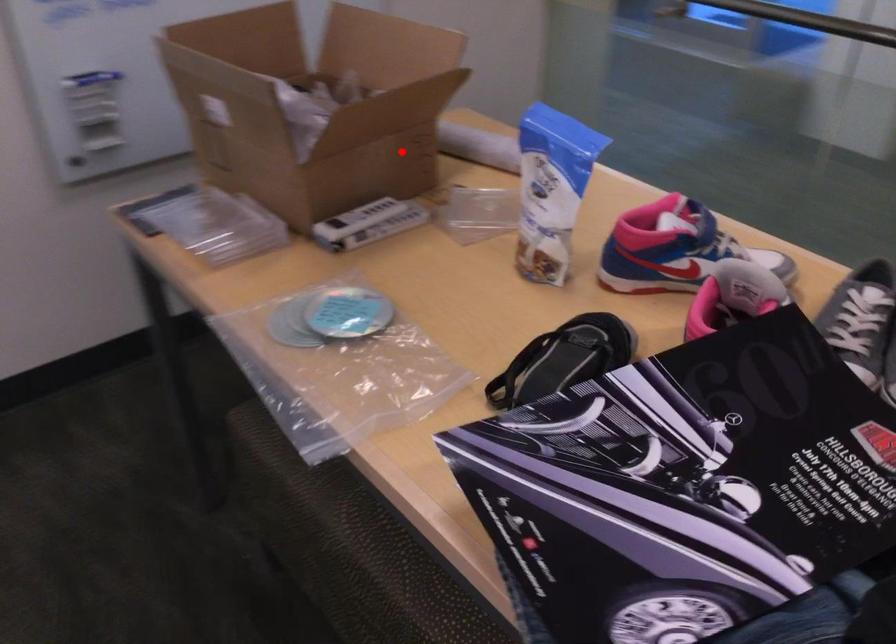
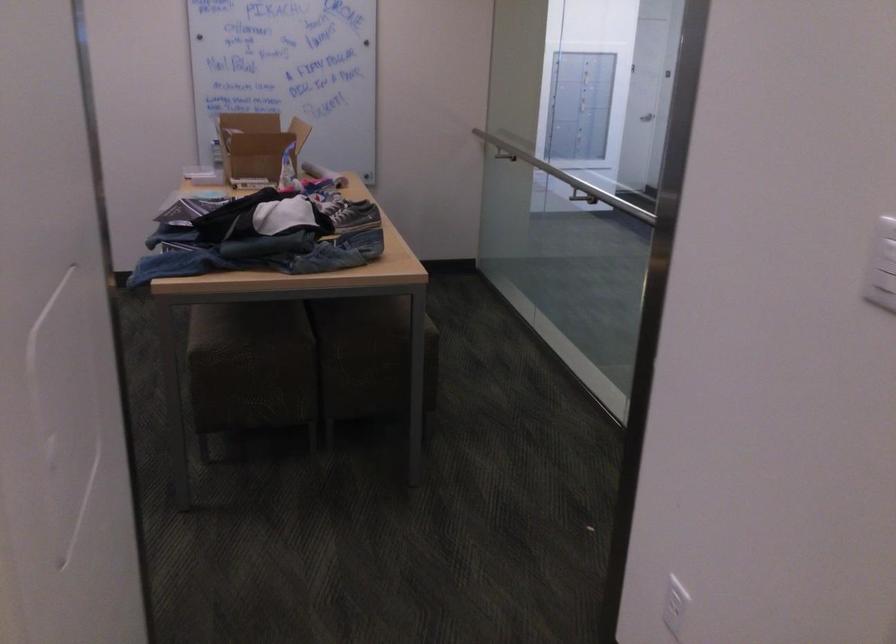
Find the pixel in the second image that matches the highlighted location in the first image.

(256, 146)